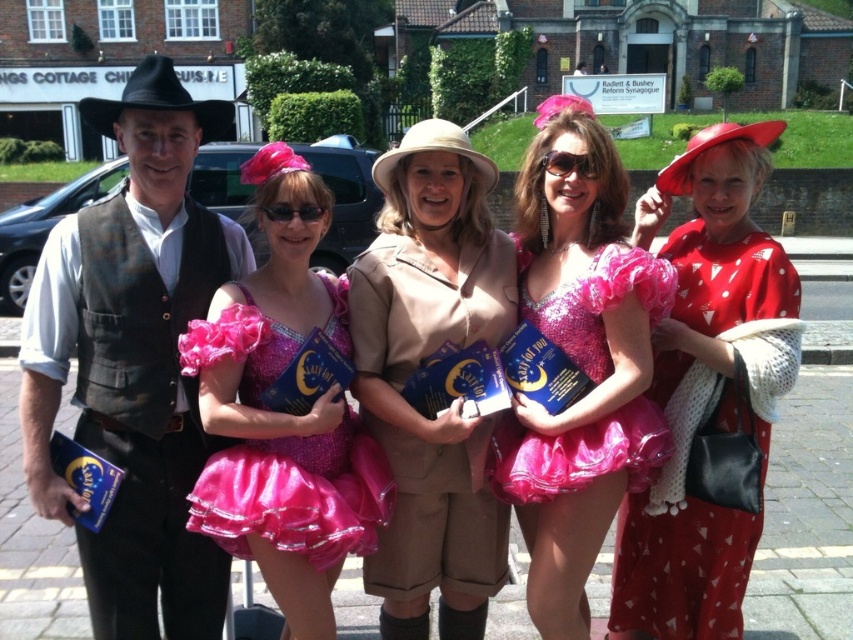
Question: Does beige fabric dress at center appear on the right side of pink sequined dress at center?

Choices:
 (A) yes
 (B) no

Answer: (A)

Question: Which point is closer to the camera?

Choices:
 (A) brown leather vest at left
 (B) pink sequined dress at center
 (C) sparkly pink dress at center
 (D) red satin dress at center

Answer: (B)

Question: Considering the relative positions of brown leather vest at left and pink sequined dress at center in the image provided, where is brown leather vest at left located with respect to pink sequined dress at center?

Choices:
 (A) right
 (B) left

Answer: (B)

Question: Which point is closer to the camera taking this photo?

Choices:
 (A) (608, 273)
 (B) (741, 545)
 (C) (426, 563)

Answer: (A)

Question: Estimate the real-world distances between objects in this image. Which object is farther from the pink sequined dress at center?

Choices:
 (A) red satin dress at center
 (B) brown leather vest at left
 (C) beige fabric dress at center
 (D) sparkly pink dress at center

Answer: (A)

Question: Can you confirm if red satin dress at center is thinner than sparkly pink dress at center?

Choices:
 (A) no
 (B) yes

Answer: (A)